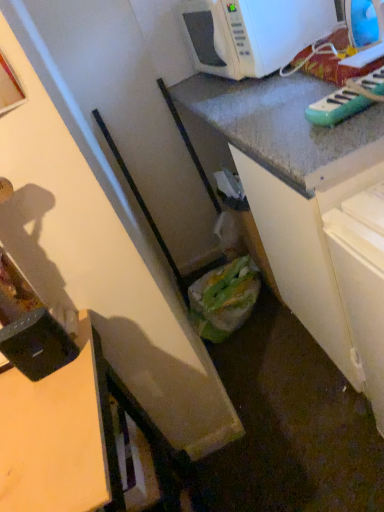
Question: From the image's perspective, is wooden desk at lower left on white glossy microwave at upper right?

Choices:
 (A) yes
 (B) no

Answer: (B)

Question: Does wooden desk at lower left come in front of white glossy microwave at upper right?

Choices:
 (A) yes
 (B) no

Answer: (A)

Question: Is the surface of wooden desk at lower left in direct contact with white glossy microwave at upper right?

Choices:
 (A) no
 (B) yes

Answer: (A)

Question: Is the position of wooden desk at lower left more distant than that of white glossy microwave at upper right?

Choices:
 (A) no
 (B) yes

Answer: (A)

Question: Is wooden desk at lower left positioned far away from white glossy microwave at upper right?

Choices:
 (A) no
 (B) yes

Answer: (B)

Question: Can white glossy microwave at upper right be found inside wooden desk at lower left?

Choices:
 (A) no
 (B) yes

Answer: (A)

Question: Considering the relative sizes of white glossy microwave at upper right and black plastic container at lower left, acting as the 1th appliance starting from the left, in the image provided, is white glossy microwave at upper right smaller than black plastic container at lower left, acting as the 1th appliance starting from the left,?

Choices:
 (A) no
 (B) yes

Answer: (A)

Question: Is white glossy microwave at upper right at the right side of black plastic container at lower left, the 1th appliance in the bottom-to-top sequence?

Choices:
 (A) yes
 (B) no

Answer: (A)

Question: Considering the relative sizes of white glossy microwave at upper right and black plastic container at lower left, acting as the 1th appliance starting from the left, in the image provided, is white glossy microwave at upper right wider than black plastic container at lower left, acting as the 1th appliance starting from the left,?

Choices:
 (A) no
 (B) yes

Answer: (B)

Question: From the image's perspective, does white glossy microwave at upper right appear lower than black plastic container at lower left, the 1th appliance in the bottom-to-top sequence?

Choices:
 (A) yes
 (B) no

Answer: (B)

Question: Does white glossy microwave at upper right lie behind black plastic container at lower left, the 1th appliance in the bottom-to-top sequence?

Choices:
 (A) no
 (B) yes

Answer: (B)

Question: Does white glossy microwave at upper right have a lesser height compared to black plastic container at lower left, the 1th appliance in the bottom-to-top sequence?

Choices:
 (A) yes
 (B) no

Answer: (B)

Question: Is the surface of green plastic toy keyboard at upper right, which is the second appliance from bottom to top, in direct contact with green plastic bag at lower center?

Choices:
 (A) yes
 (B) no

Answer: (B)